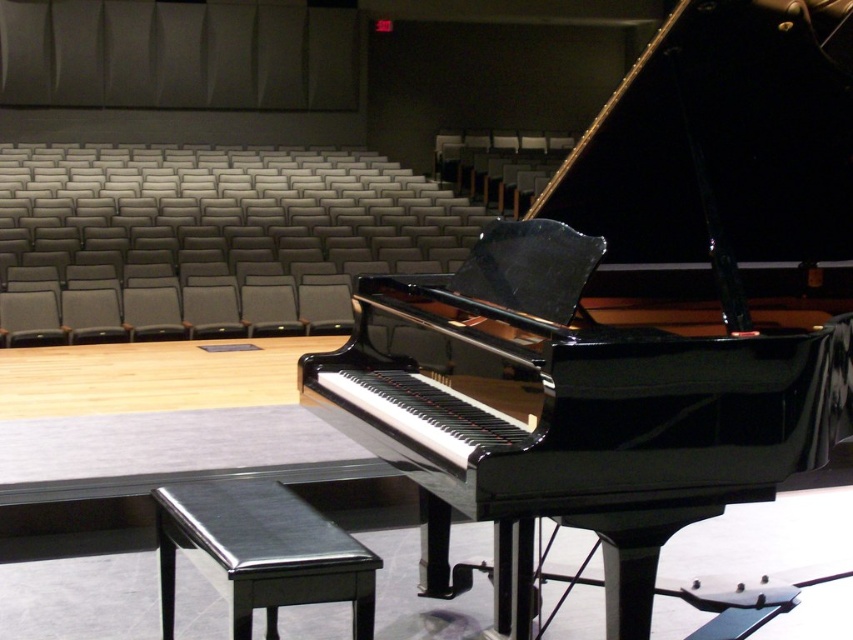
Can you confirm if glossy black piano at center is taller than shiny black stool at lower center?

Yes, glossy black piano at center is taller than shiny black stool at lower center.

Between glossy black piano at center and shiny black stool at lower center, which one has more height?

glossy black piano at center is taller.

Is point (769, 420) positioned before point (265, 602)?

Yes, it is.

Identify the location of glossy black piano at center. (631, 321).